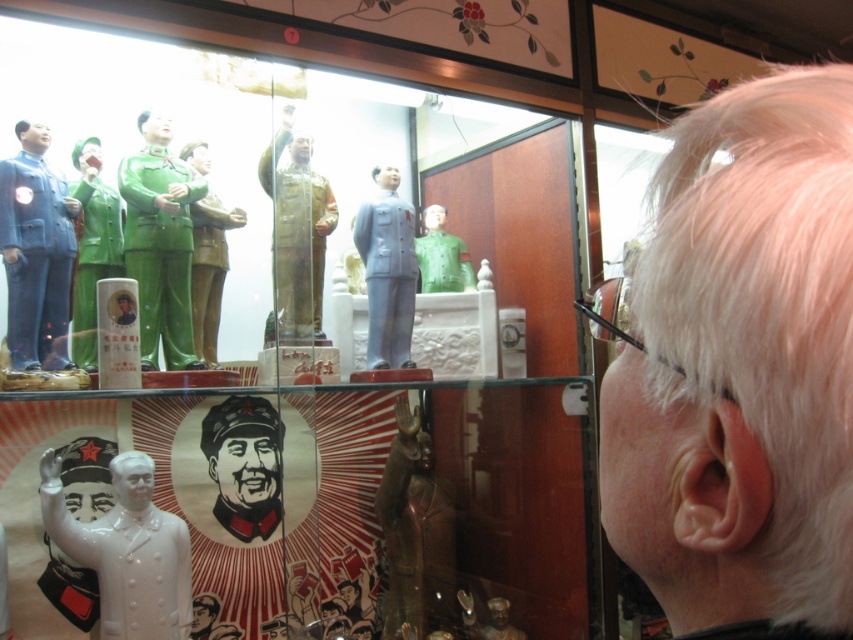
You are standing in front of the display case in the shop. You want to know how far you are from the point marked at coordinates point (495, 449). Can you determine the distance?

The distance between you and the point (495, 449) is 1.73 meters.

You are a customer in the shop looking at the display case. You want to know which object is taller between the matte porcelain figure at center and the green glossy statue at left. Can you determine this based on their positions?

The matte porcelain figure at center is taller than the green glossy statue at left.

You are a customer in the shop and want to know which of the two points, point [554,292] or point [216,342], is closer to you. Can you determine this based on the display case layout?

Point [554,292] is closer to you than point [216,342] because it is further to the viewer in the display case.